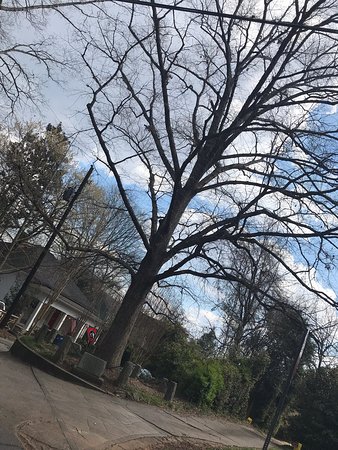
Locate an element on the screen. white columns is located at coordinates (35, 314), (60, 322), (78, 332).